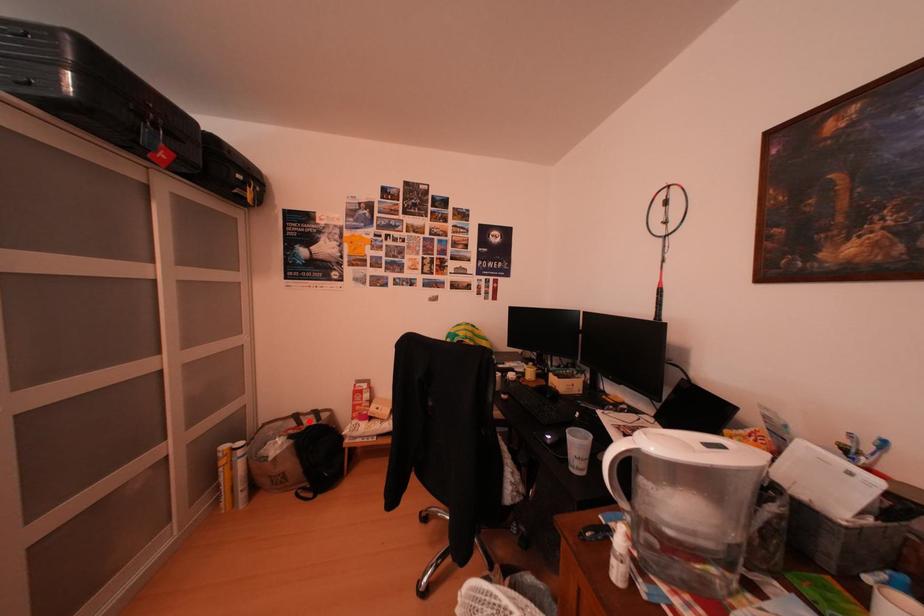
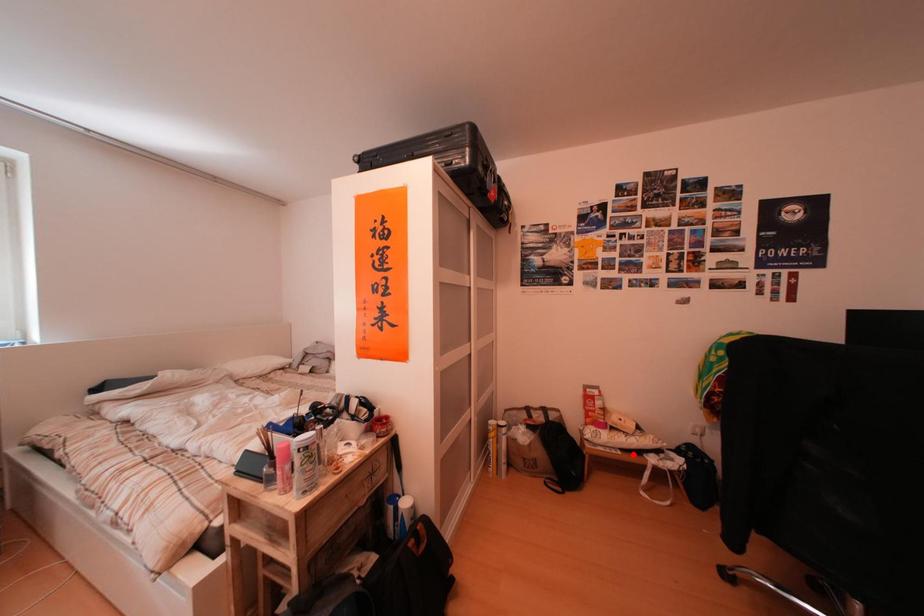
I am providing you with two images of the same scene from different viewpoints. A red point is marked on the first image and another point is marked on the second image. Are the points marked in image1 and image2 representing the same 3D position?

No